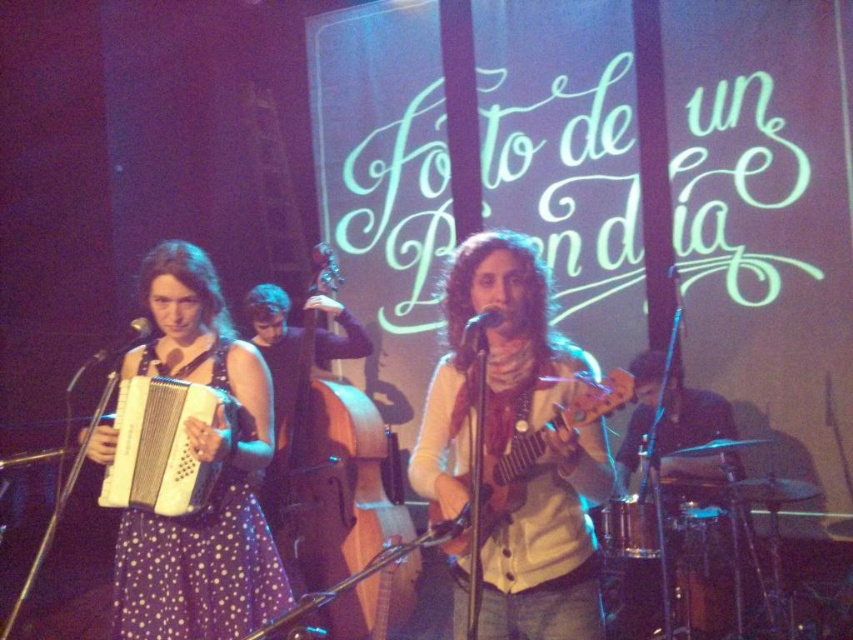
Question: In this image, where is purple dotted dress at left located relative to wooden cello at center?

Choices:
 (A) right
 (B) left

Answer: (B)

Question: Does matte white accordion at left have a lesser width compared to smooth brown drum set at lower right?

Choices:
 (A) no
 (B) yes

Answer: (B)

Question: Which point is closer to the camera?

Choices:
 (A) (398, 522)
 (B) (200, 321)

Answer: (B)

Question: Which point is farther from the camera taking this photo?

Choices:
 (A) [171, 417]
 (B) [259, 538]
 (C) [625, 476]

Answer: (C)

Question: Considering the relative positions of wooden ukulele at center and wooden cello at center in the image provided, where is wooden ukulele at center located with respect to wooden cello at center?

Choices:
 (A) left
 (B) right

Answer: (B)

Question: Estimate the real-world distances between objects in this image. Which object is closer to the wooden ukulele at center?

Choices:
 (A) smooth brown drum set at lower right
 (B) wooden cello at center
 (C) matte white accordion at left

Answer: (C)